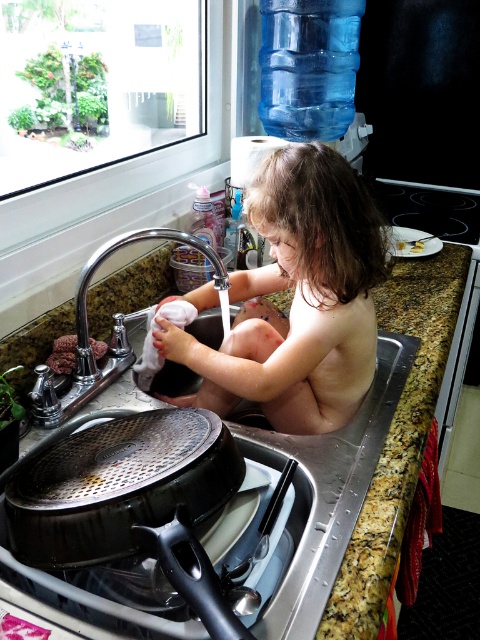
Question: Is granite at upper right closer to the viewer compared to brown crumbly food at sink left?

Choices:
 (A) no
 (B) yes

Answer: (B)

Question: Which point appears farthest from the camera in this image?

Choices:
 (A) (194, 240)
 (B) (326, 422)

Answer: (B)

Question: Considering the relative positions of naked toddler at sink and granite at upper right in the image provided, where is naked toddler at sink located with respect to granite at upper right?

Choices:
 (A) right
 (B) left

Answer: (B)

Question: Which is nearer to the naked toddler at sink?

Choices:
 (A) brown crumbly food at sink left
 (B) granite countertop at sink
 (C) silver metallic faucet at upper left
 (D) granite at upper right

Answer: (C)

Question: Which of the following is the farthest from the observer?

Choices:
 (A) (52, 355)
 (B) (261, 289)
 (C) (213, 259)
 (D) (373, 525)

Answer: (B)

Question: Is granite countertop at sink positioned at the back of silver metallic faucet at upper left?

Choices:
 (A) yes
 (B) no

Answer: (B)